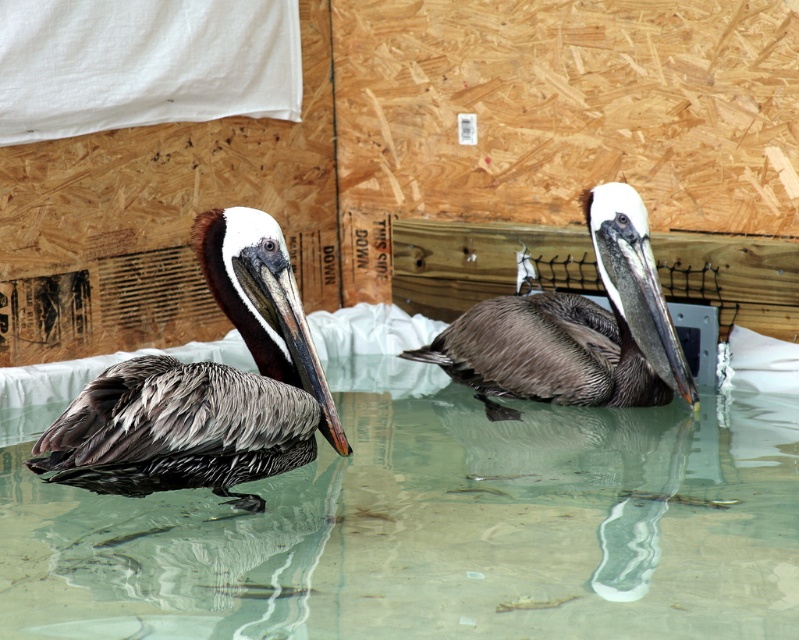
You are a photographer adjusting your camera settings to focus on two points in the image. The first point is labeled as point [140,618] and the second is point [499,368]. Which point should you focus on first if you want to ensure both points are in focus without moving the camera?

You should focus on point [140,618] first because it is closer to the camera than point [499,368]. By focusing on the closer point, the farther point may still be within the depth of field, ensuring both are in focus without moving the camera.

You are a researcher studying the pelicans in this image. You need to place a sensor on the clear water at center to monitor water quality. Where exactly should you place the sensor in terms of coordinates?

The clear water at center should have the sensor placed at coordinates point (436,529).

You are a wildlife photographer aiming to capture a closeup of the brown feathered pelican at left. You are currently standing at the point with coordinates point (x=205, y=387). Can you take the photo without moving your position?

Yes, because the point (x=205, y=387) corresponds to the brown feathered pelican at left, so you are already positioned at the desired subject.